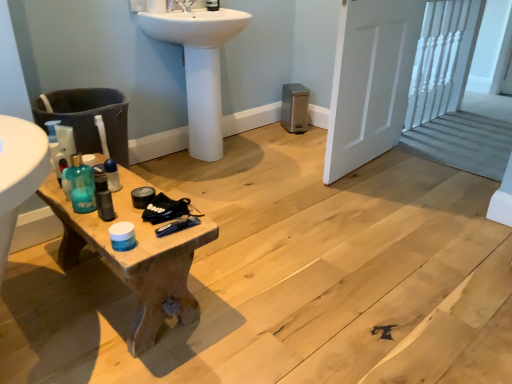
Question: From the image's perspective, relative to translucent plastic bottle at center, which ranks as the 1th toiletry in front-to-back order, is woodenwoodentable at left above or below?

Choices:
 (A) below
 (B) above

Answer: (A)

Question: Is point (147, 317) closer or farther from the camera than point (112, 182)?

Choices:
 (A) farther
 (B) closer

Answer: (B)

Question: Estimate the real-world distances between objects in this image. Which object is farther from the translucent plastic bottle at center, the second toiletry when ordered from back to front?

Choices:
 (A) white glossy sink at upper center
 (B) translucent plastic bottle at left
 (C) woodenwoodentable at left
 (D) white wooden door at right
 (E) matte black soap dispenser at upper center, acting as the first toiletry starting from the right

Answer: (D)

Question: Estimate the real-world distances between objects in this image. Which object is closer to the translucent plastic bottle at center, the 1th toiletry from the left?

Choices:
 (A) matte black soap dispenser at upper center, acting as the second toiletry starting from the front
 (B) woodenwoodentable at left
 (C) white wooden door at right
 (D) white glossy sink at upper center
 (E) translucent plastic bottle at left

Answer: (E)